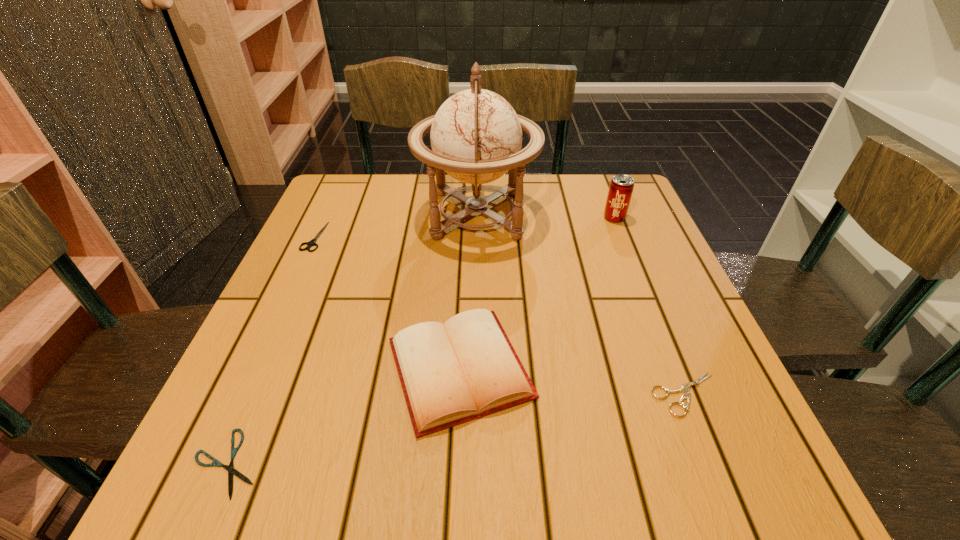
At what (x,y) coordinates should I click in order to perform the action: click on object that is the fourth closest to the fourth tallest object. Please return your answer as a coordinate pair (x, y). Looking at the image, I should click on (621, 187).

Locate which shears is the closest to the nearest shears. Please provide its 2D coordinates. Your answer should be formatted as a tuple, i.e. [(x, y)], where the tuple contains the x and y coordinates of a point satisfying the conditions above.

[(312, 242)]

Choose which shears is the nearest neighbor to the third shortest object. Please provide its 2D coordinates. Your answer should be formatted as a tuple, i.e. [(x, y)], where the tuple contains the x and y coordinates of a point satisfying the conditions above.

[(230, 468)]

You are a GUI agent. You are given a task and a screenshot of the screen. Output one action in this format:
    pyautogui.click(x=<x>, y=<y>)
    Task: Click on the vacant space that satisfies the following two spatial constraints: 1. at the front of the second nearest shears showing Africa; 2. on the right side of the tallest object
    
    Given the screenshot: What is the action you would take?
    pyautogui.click(x=475, y=394)

Where is `free space that satisfies the following two spatial constraints: 1. on the back side of the shortest shears; 2. on the right side of the second shortest object`? free space that satisfies the following two spatial constraints: 1. on the back side of the shortest shears; 2. on the right side of the second shortest object is located at coordinates (257, 394).

Identify the location of free spot that satisfies the following two spatial constraints: 1. at the front of the tallest object showing Africa; 2. on the front side of the shortest shears. (474, 463).

Find the location of a particular element. free space that satisfies the following two spatial constraints: 1. on the front side of the fourth tallest object; 2. on the right side of the shortest shears is located at coordinates (209, 463).

The width and height of the screenshot is (960, 540). Find the location of `vacant area that satisfies the following two spatial constraints: 1. on the back side of the nearest shears; 2. on the left side of the rightmost shears`. vacant area that satisfies the following two spatial constraints: 1. on the back side of the nearest shears; 2. on the left side of the rightmost shears is located at coordinates (257, 394).